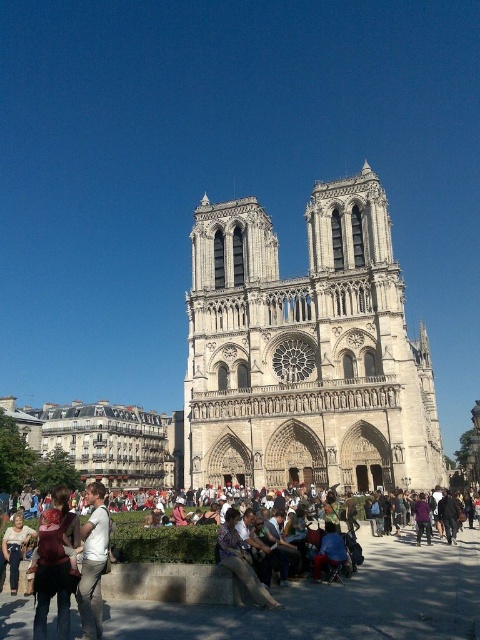
Who is lower down, denim jacket at lower center or white cotton shirt at lower left?

Positioned lower is white cotton shirt at lower left.

Can you confirm if denim jacket at lower center is thinner than white cotton shirt at lower left?

In fact, denim jacket at lower center might be wider than white cotton shirt at lower left.

Is point (235, 630) behind point (81, 636)?

No, it is in front of (81, 636).

Identify the location of denim jacket at lower center. This screenshot has height=640, width=480. (324, 600).

Between stone gothic cathedral at center and white cotton shirt at lower left, which one has more height?

Standing taller between the two is stone gothic cathedral at center.

Is point (238, 212) in front of point (97, 621)?

No, (238, 212) is behind (97, 621).

Who is more forward, (x=391, y=481) or (x=84, y=554)?

Point (x=84, y=554) is more forward.

Where is `stone gothic cathedral at center`? stone gothic cathedral at center is located at coordinates (305, 352).

Between stone gothic cathedral at center and leather jacket at center, which one has more height?

stone gothic cathedral at center

Who is more distant from viewer, [262,314] or [239,579]?

Point [262,314]

Is point (373, 349) positioned after point (266, 602)?

Yes, point (373, 349) is behind point (266, 602).

In order to click on stone gothic cathedral at center in this screenshot , I will do `click(305, 352)`.